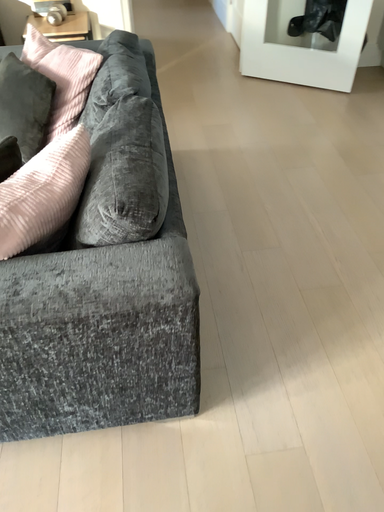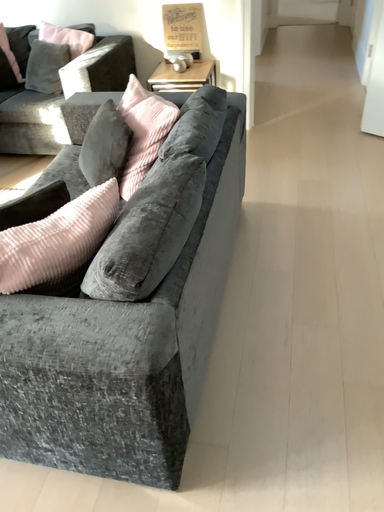
Question: How did the camera likely rotate when shooting the video?

Choices:
 (A) rotated right
 (B) rotated left

Answer: (B)